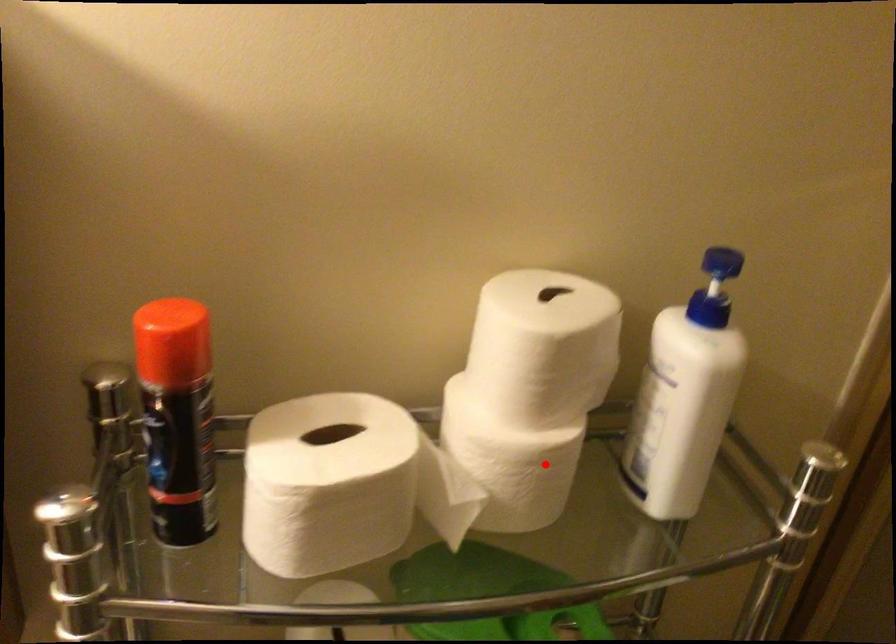
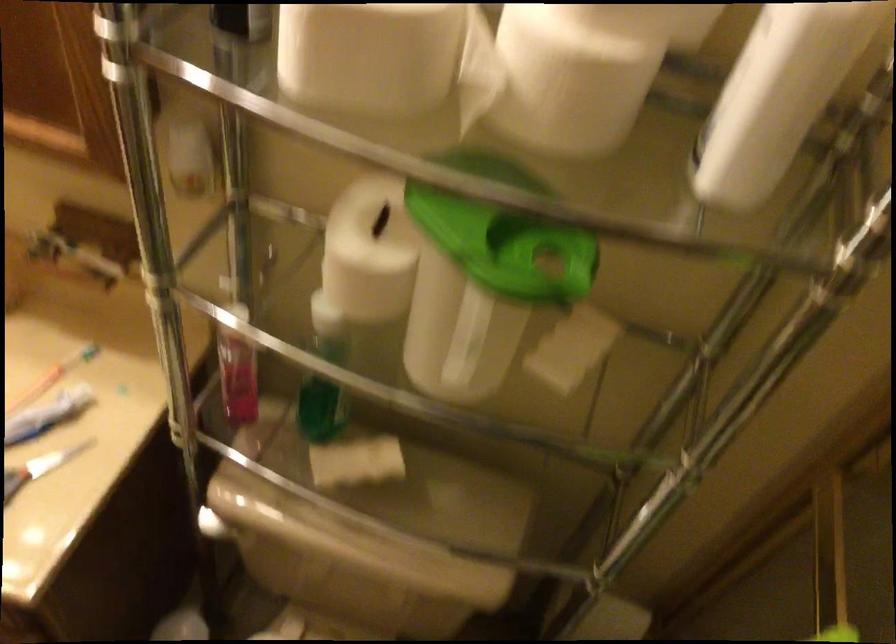
Question: I am providing you with two images of the same scene from different viewpoints. Image1 has a red point marked. In image2, the corresponding 3D location appears at what relative position? Reply with the corresponding letter.

Choices:
 (A) Closer
 (B) Farther

Answer: (A)